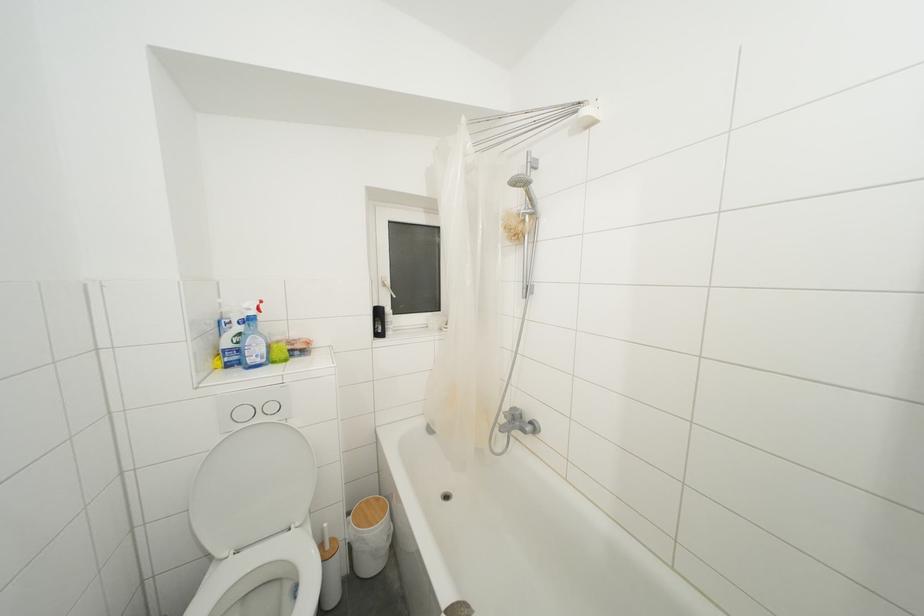
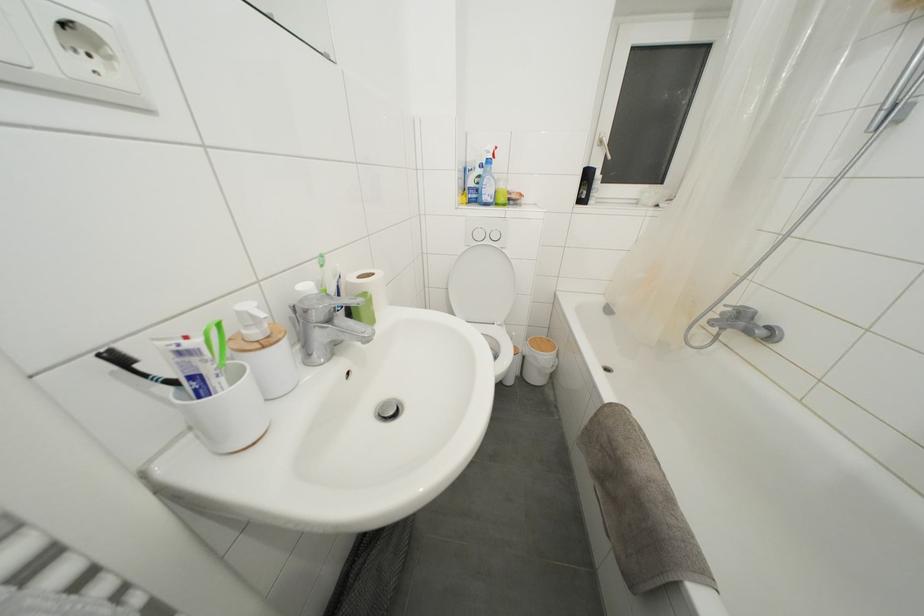
Where in the second image is the point corresponding to pixel 371 506 from the first image?

(544, 342)